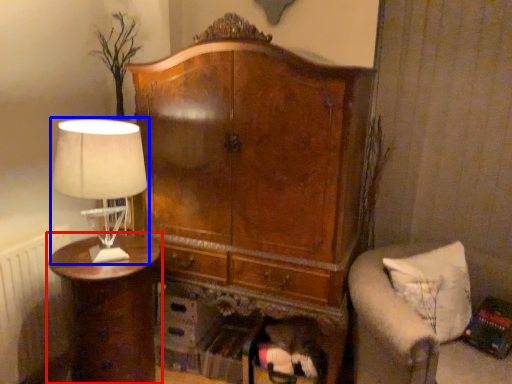
Question: Among these objects, which one is nearest to the camera, nightstand (highlighted by a red box) or lamp (highlighted by a blue box)?

Choices:
 (A) nightstand
 (B) lamp

Answer: (B)